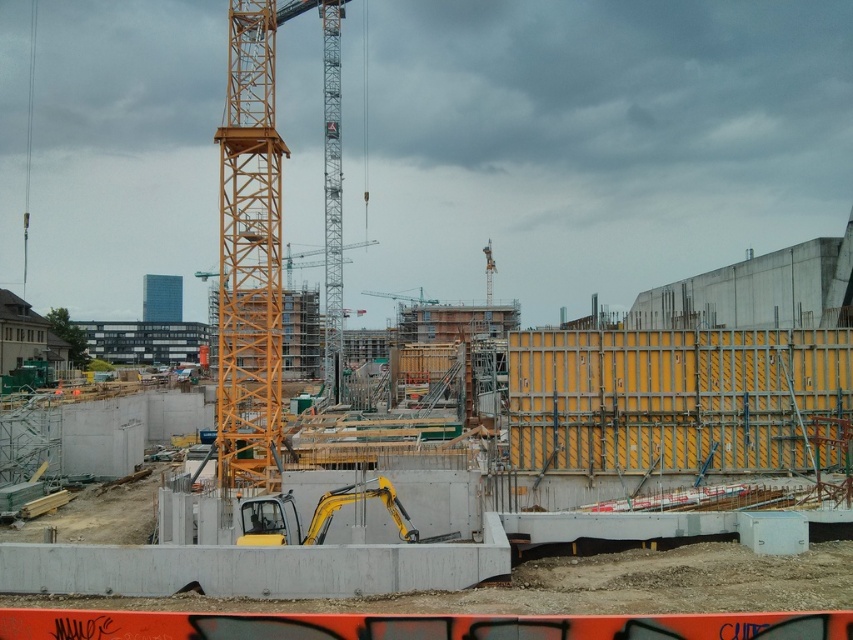
Question: Is yellow metallic tower crane at center further to the viewer compared to yellow metallic excavator at center?

Choices:
 (A) yes
 (B) no

Answer: (A)

Question: Which point is farther to the camera?

Choices:
 (A) yellow metallic tower crane at center
 (B) yellow metallic excavator at center

Answer: (A)

Question: Which point appears farthest from the camera in this image?

Choices:
 (A) (271, 444)
 (B) (273, 522)

Answer: (A)

Question: Can you confirm if yellow metallic tower crane at center is positioned to the right of yellow metallic excavator at center?

Choices:
 (A) yes
 (B) no

Answer: (B)

Question: Does yellow metallic tower crane at center come in front of yellow metallic excavator at center?

Choices:
 (A) yes
 (B) no

Answer: (B)